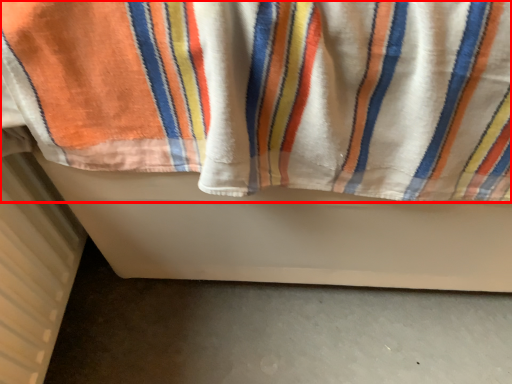
Question: From the image's perspective, what is the correct spatial positioning of towel (annotated by the red box) in reference to radiator?

Choices:
 (A) below
 (B) above

Answer: (B)